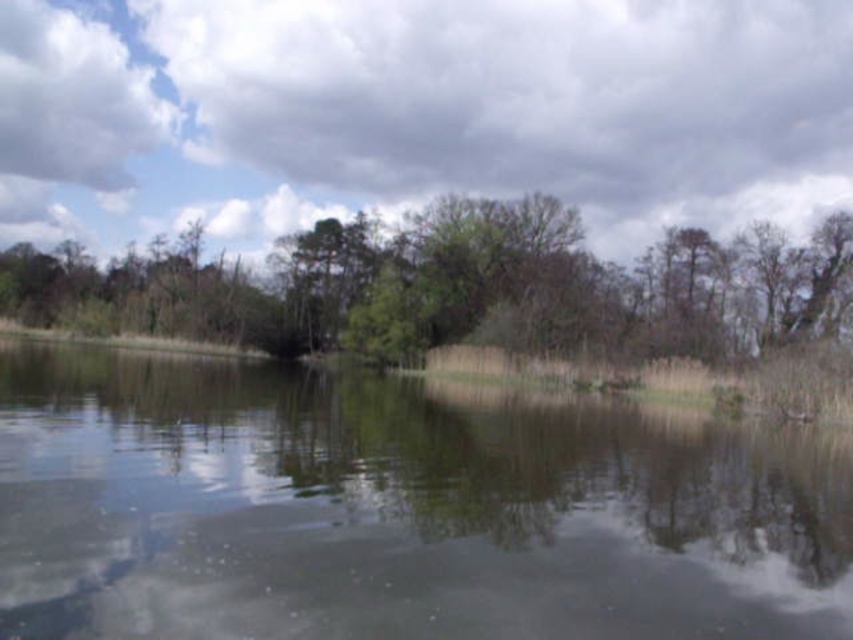
You are standing at the edge of the lake and want to find the clear water at center. Based on the coordinates provided, in which direction should you look relative to your position?

The clear water at center is located at coordinates point (398, 509). Since coordinates typically represent positions on a grid where the origin is at the bottom left, looking towards the upper right direction from your position at the edge would align with those coordinates.

You are standing on the lakeshore and see the clear water at center and the green leafy tree at center. Which object is closer to the ground?

The clear water at center is below the green leafy tree at center, so the clear water at center is closer to the ground.

You are standing at the edge of the lake and see the clear water at center and the green leafy tree at center. Which one appears taller from your perspective?

The green leafy tree at center appears taller than the clear water at center because the clear water at center is not as tall as the green leafy tree at center.